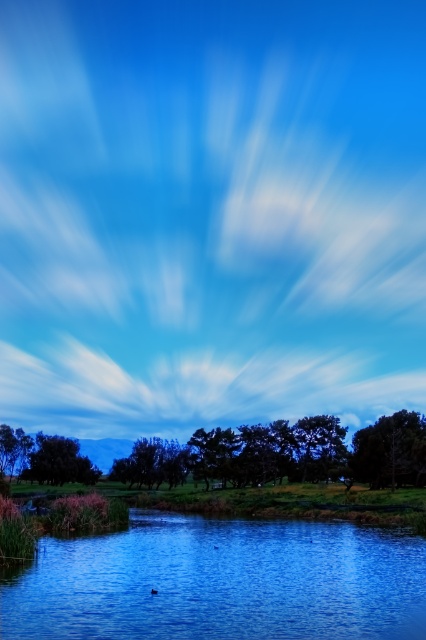
Question: Is the position of blue glassy river at lower center less distant than that of green leafy trees at center?

Choices:
 (A) yes
 (B) no

Answer: (A)

Question: Which object is positioned closest to the green matte tree at lower left?

Choices:
 (A) blue glassy river at lower center
 (B) green matte tree at center
 (C) green matte tree at center-right

Answer: (B)

Question: Which object is positioned farthest from the green matte tree at center?

Choices:
 (A) green matte tree at center-right
 (B) green matte tree at lower left

Answer: (A)

Question: Which point is farther to the camera?

Choices:
 (A) green matte tree at center
 (B) blue glassy river at lower center

Answer: (A)

Question: Is blue glassy river at lower center below green leafy trees at center?

Choices:
 (A) no
 (B) yes

Answer: (A)

Question: Is blue glassy river at lower center wider than green leafy trees at center?

Choices:
 (A) no
 (B) yes

Answer: (A)